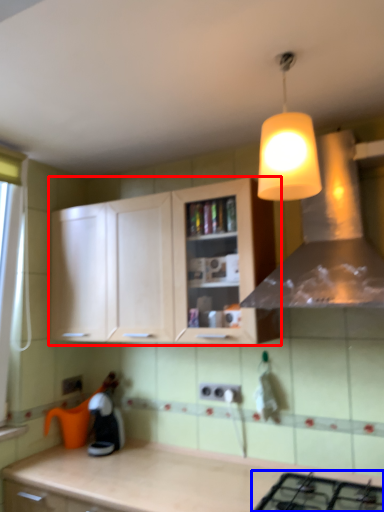
Question: Among these objects, which one is farthest to the camera, cabinetry (highlighted by a red box) or gas stove (highlighted by a blue box)?

Choices:
 (A) cabinetry
 (B) gas stove

Answer: (A)